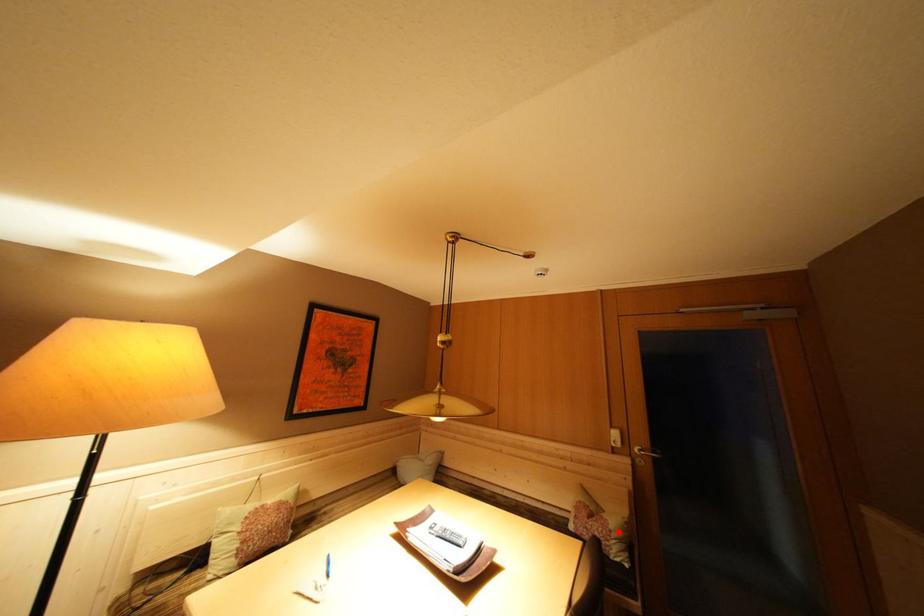
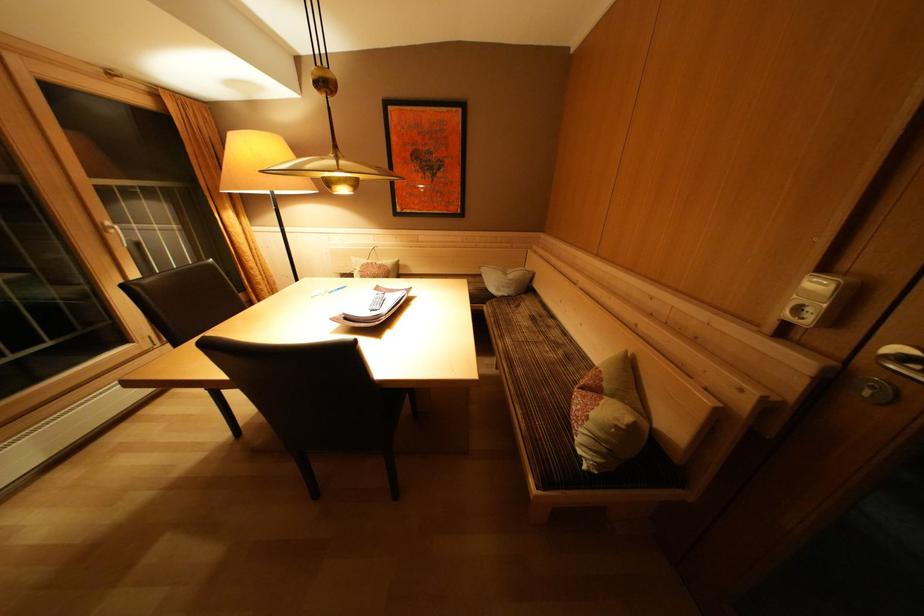
The point at the highlighted location is marked in the first image. Where is the corresponding point in the second image?

(600, 419)